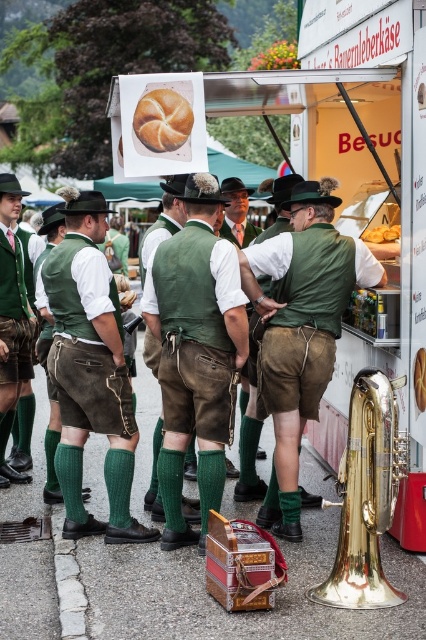
You are taking a photo of the festival scene and want to focus on both the golden tuba and the small wooden box. The golden tuba corresponds to point (325,64) and the wooden box corresponds to point (155,122). Which object is closer to your camera?

Point (325,64) is further to the camera than point (155,122). Therefore, the wooden box at point (155,122) is closer to the camera than the golden tuba at point (325,64).

You are a tailor observing two vests in the scene. The green suede vest at center and the matte green vest at left. Which vest is shorter in height?

The green suede vest at center is not as tall as the matte green vest at left, so the green suede vest at center is shorter in height.

You are a food vendor at the festival. You need to place a new menu board that requires 2 meters of vertical space. Can the matte white food truck at center accommodate this requirement based on its height compared to the brown matte bagel at center?

The matte white food truck at center is much taller than the brown matte bagel at center, so it can accommodate the 2 meters of vertical space required for the new menu board.